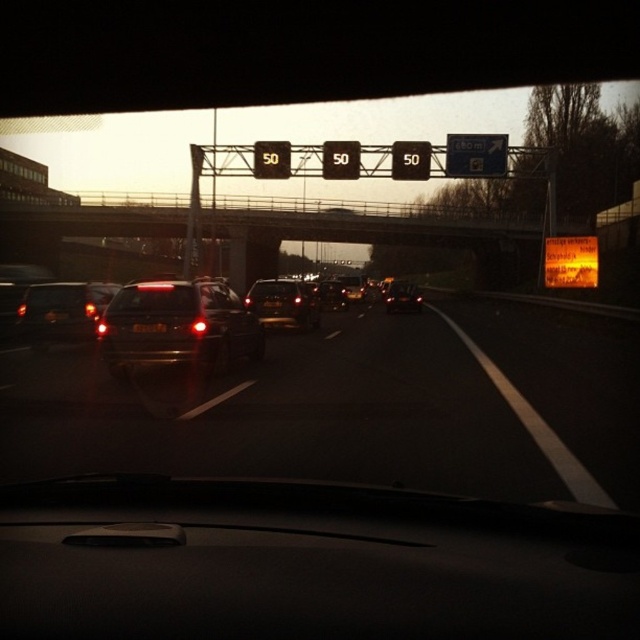
Can you confirm if matte black car at center is shorter than shiny metallic sedan at center?

Yes, matte black car at center is shorter than shiny metallic sedan at center.

Is point (220, 288) positioned in front of point (404, 285)?

Yes, point (220, 288) is closer to viewer.

Locate an element on the screen. The width and height of the screenshot is (640, 640). matte black car at center is located at coordinates (179, 326).

Can you confirm if matte black car at center is smaller than shiny metallic car at center?

Actually, matte black car at center might be larger than shiny metallic car at center.

Which is below, matte black car at center or shiny metallic car at center?

matte black car at center

Is point (124, 346) farther from viewer compared to point (260, 296)?

No, it is in front of (260, 296).

This screenshot has width=640, height=640. I want to click on matte black car at center, so click(x=179, y=326).

Between metallic brown speed limit sign at center and shiny black sedan at center, which one appears on the right side from the viewer's perspective?

Positioned to the right is metallic brown speed limit sign at center.

Which is in front, point (419, 179) or point (330, 288)?

Point (330, 288) is more forward.

Where is `metallic brown speed limit sign at center`? The height and width of the screenshot is (640, 640). metallic brown speed limit sign at center is located at coordinates (410, 161).